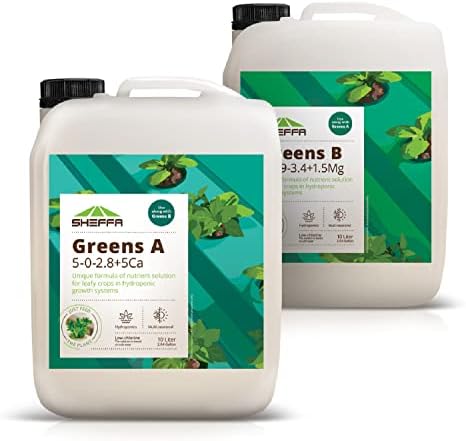
I want to click on white floor, so click(x=320, y=363).